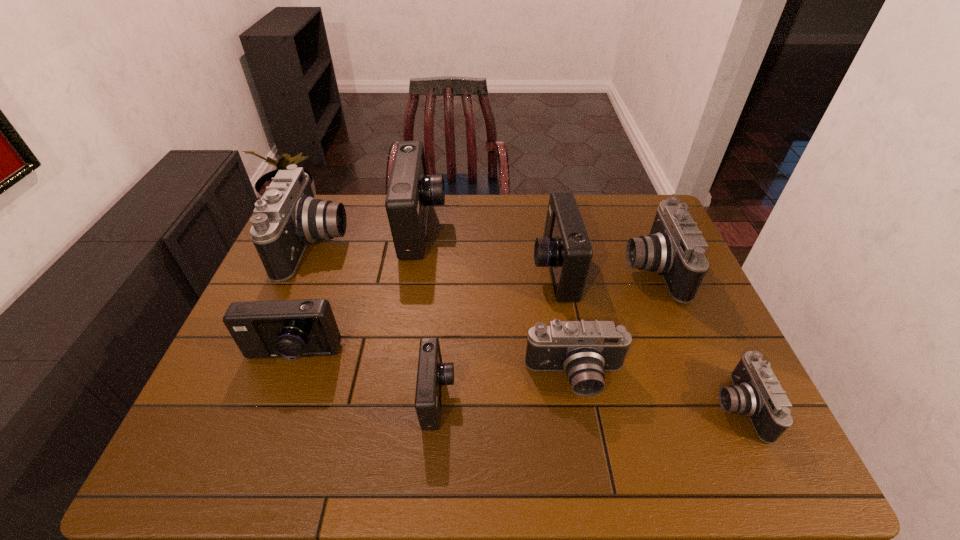
Identify the location of the biggest blue camera. (411, 191).

Where is `the leftmost black camera`? This screenshot has height=540, width=960. the leftmost black camera is located at coordinates (287, 218).

The height and width of the screenshot is (540, 960). What are the coordinates of `the rightmost blue camera` in the screenshot? It's located at (565, 248).

Locate an element on the screen. Image resolution: width=960 pixels, height=540 pixels. the third smallest black camera is located at coordinates (675, 248).

Identify the location of the second smallest blue camera. This screenshot has width=960, height=540. (290, 329).

Identify the location of the third biggest black camera. The width and height of the screenshot is (960, 540). (583, 349).

This screenshot has height=540, width=960. In order to click on the smallest blue camera in this screenshot , I will do `click(432, 373)`.

The width and height of the screenshot is (960, 540). What are the coordinates of `the smallest black camera` in the screenshot? It's located at (757, 393).

Where is `vacant space located 0.060m on the front-facing side of the biggest blue camera`? vacant space located 0.060m on the front-facing side of the biggest blue camera is located at coordinates (464, 228).

Find the location of a particular element. Image resolution: width=960 pixels, height=540 pixels. free location located on the front-facing side of the biggest black camera is located at coordinates (455, 246).